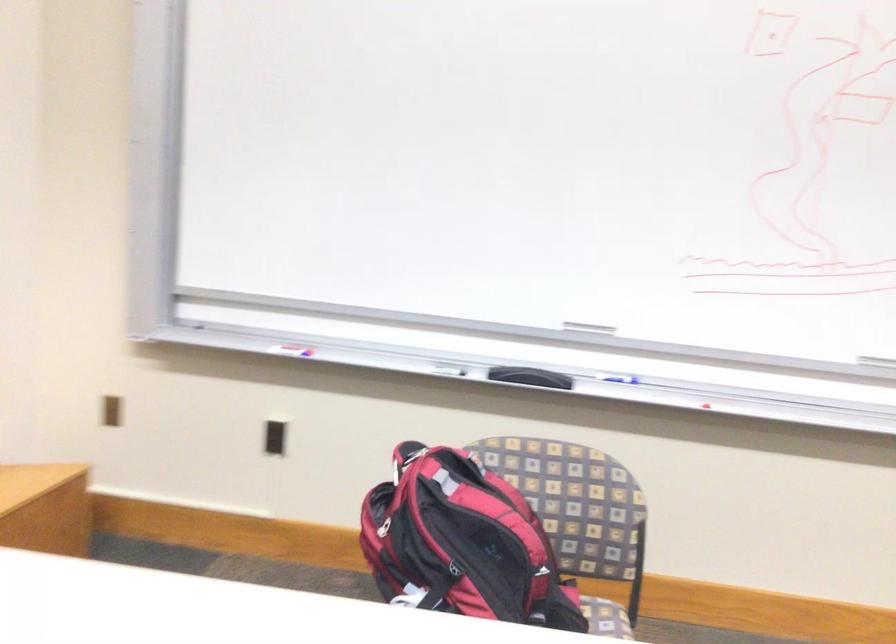
Describe the element at coordinates (606, 618) in the screenshot. This screenshot has width=896, height=644. I see `the chair sitting surface` at that location.